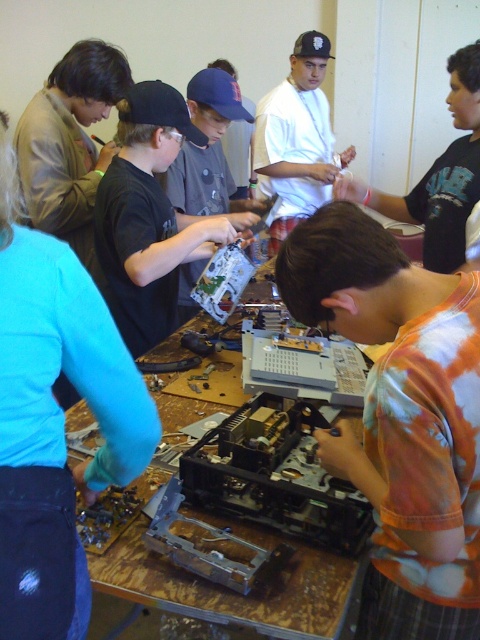
Does brushed metal circuit board at lower left have a greater width compared to white matte shirt at center?

No, brushed metal circuit board at lower left is not wider than white matte shirt at center.

Is point (3, 461) in front of point (314, 198)?

Yes, it is.

Is point (21, 504) positioned in front of point (257, 125)?

Yes, point (21, 504) is in front of point (257, 125).

Where is `brushed metal circuit board at lower left`? brushed metal circuit board at lower left is located at coordinates (55, 420).

What do you see at coordinates (230, 592) in the screenshot? The height and width of the screenshot is (640, 480). I see `wooden table at center` at bounding box center [230, 592].

Between point (286, 584) and point (285, 172), which one is positioned in front?

Positioned in front is point (286, 584).

Which is behind, point (156, 481) or point (315, 100)?

Positioned behind is point (315, 100).

Locate an element on the screen. The image size is (480, 640). wooden table at center is located at coordinates (230, 592).

Is point (12, 186) in front of point (90, 413)?

Yes.

Measure the distance between brushed metal circuit board at lower left and wooden table at center.

They are 40.53 centimeters apart.

Measure the distance between brushed metal circuit board at lower left and camera.

A distance of 26.12 inches exists between brushed metal circuit board at lower left and camera.

The image size is (480, 640). I want to click on brushed metal circuit board at lower left, so click(x=55, y=420).